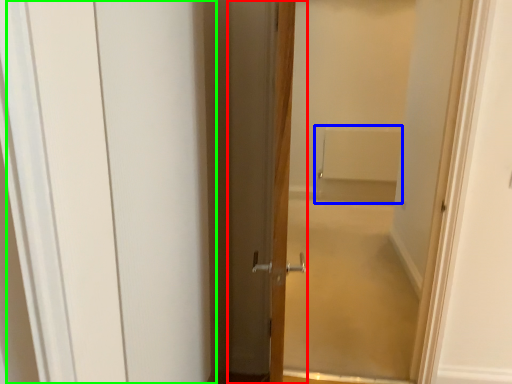
Question: Estimate the real-world distances between objects in this image. Which object is farther from door (highlighted by a red box), bath (highlighted by a blue box) or barn door (highlighted by a green box)?

Choices:
 (A) bath
 (B) barn door

Answer: (A)